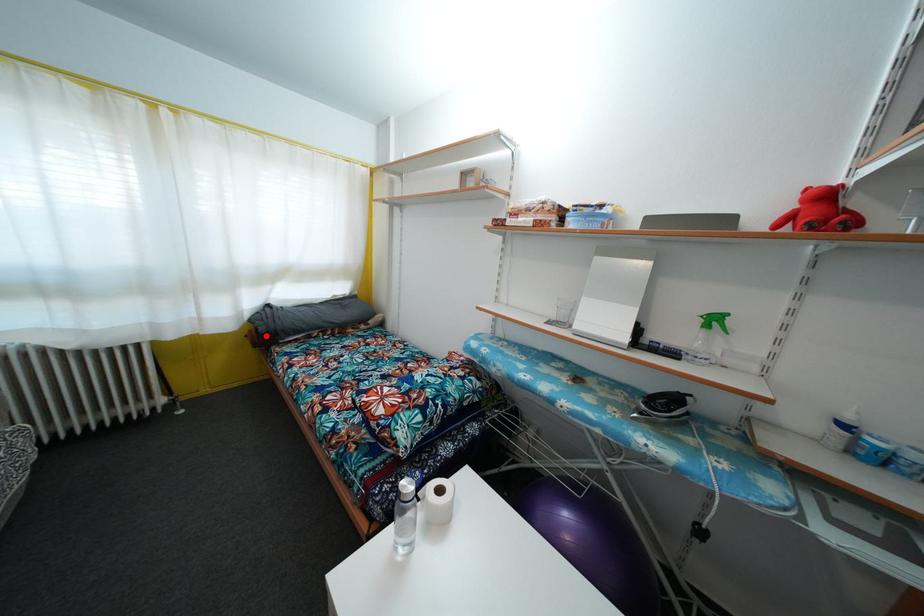
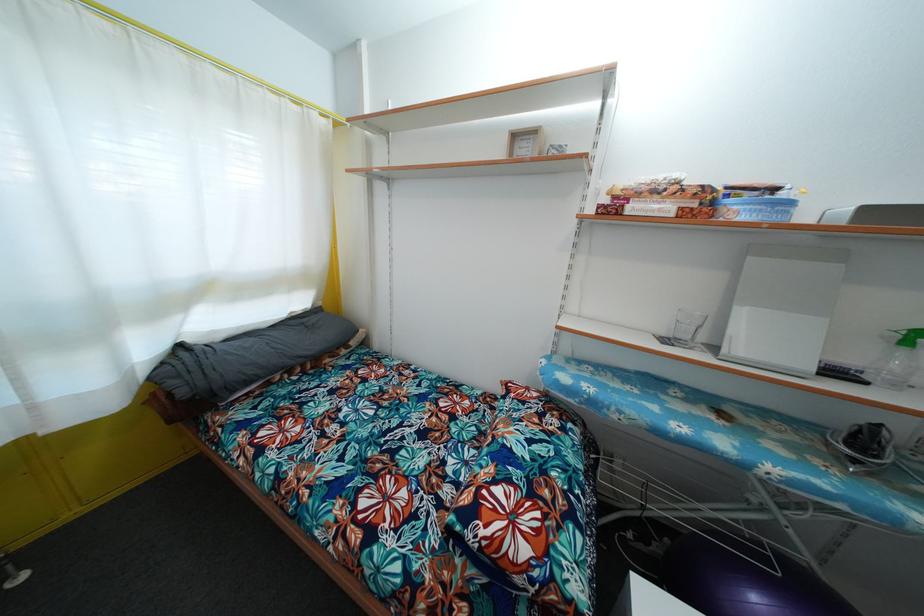
Locate, in the second image, the point that corresponds to the highlighted location in the first image.

(187, 399)